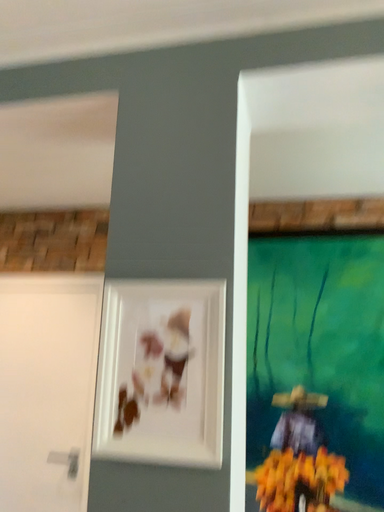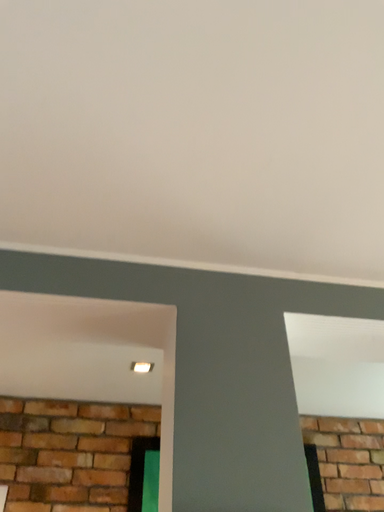
Question: Which way did the camera rotate in the video?

Choices:
 (A) rotated left
 (B) rotated right

Answer: (B)